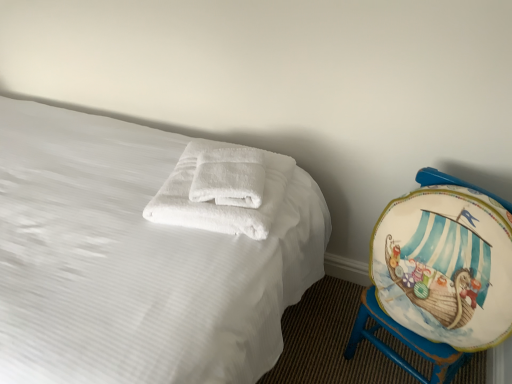
This screenshot has height=384, width=512. Find the location of `vacant position to the left of white soft towel at center`. vacant position to the left of white soft towel at center is located at coordinates (177, 187).